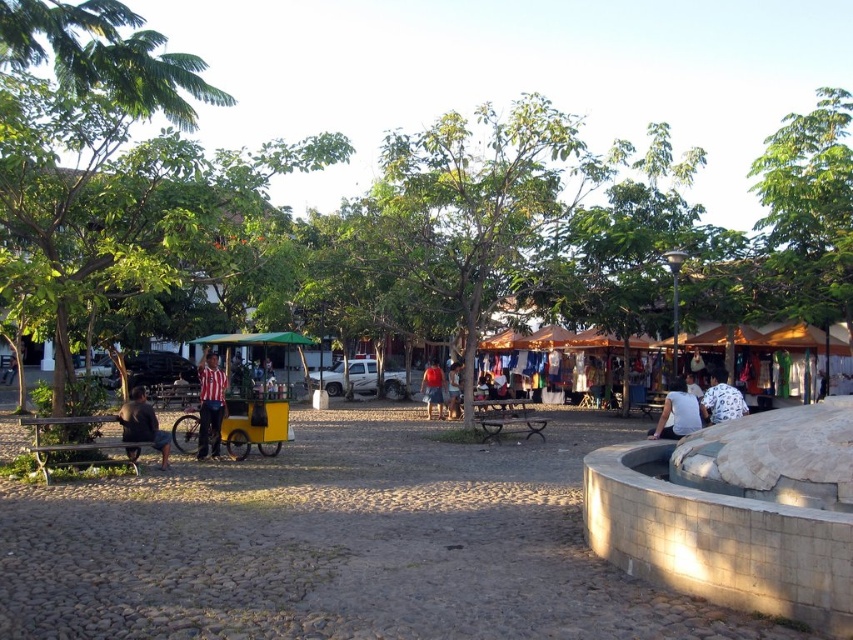
Question: Among these objects, which one is farthest from the camera?

Choices:
 (A) striped fabric shirt at center
 (B) denim shorts at center
 (C) white cotton shirt at lower right
 (D) green leafy tree at left

Answer: (B)

Question: Is striped fabric shirt at center below matte red shirt at center?

Choices:
 (A) yes
 (B) no

Answer: (B)

Question: Is striped fabric shirt at center to the left of dark gray fabric shirt at lower left from the viewer's perspective?

Choices:
 (A) yes
 (B) no

Answer: (A)

Question: Which point is farther to the camera?

Choices:
 (A) (453, 216)
 (B) (74, 54)
 (C) (142, 412)

Answer: (A)

Question: Which of these objects is positioned closest to the green leafy tree at center?

Choices:
 (A) dark gray fabric shirt at lower left
 (B) yellow matte cart at center
 (C) matte red shirt at center

Answer: (C)

Question: Is dark gray fabric shirt at lower left behind denim shorts at center?

Choices:
 (A) no
 (B) yes

Answer: (A)